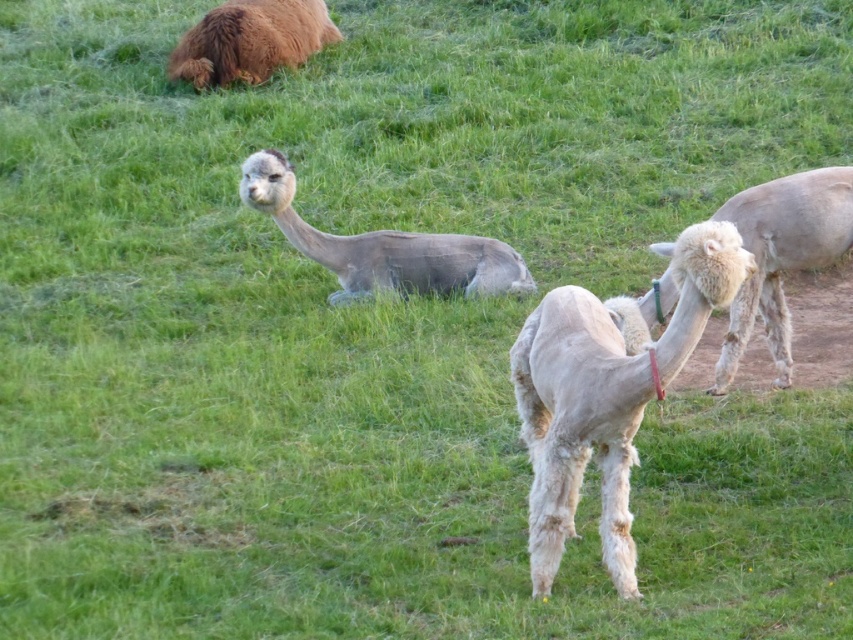
Question: Is white woolen camel at center smaller than fuzzy gray alpaca at center?

Choices:
 (A) yes
 (B) no

Answer: (B)

Question: Estimate the real-world distances between objects in this image. Which object is closer to the white woolen camel at right?

Choices:
 (A) brown fluffy camel at upper left
 (B) white woolen camel at center
 (C) fuzzy gray alpaca at center

Answer: (B)

Question: Estimate the real-world distances between objects in this image. Which object is closer to the fuzzy gray alpaca at center?

Choices:
 (A) white woolen camel at center
 (B) brown fluffy camel at upper left
 (C) white woolen camel at right

Answer: (C)

Question: Which object is closer to the camera taking this photo?

Choices:
 (A) white woolen camel at right
 (B) brown fluffy camel at upper left
 (C) white woolen camel at center

Answer: (C)

Question: In this image, where is white woolen camel at center located relative to brown fluffy camel at upper left?

Choices:
 (A) below
 (B) above

Answer: (A)

Question: Where is white woolen camel at center located in relation to brown fluffy camel at upper left in the image?

Choices:
 (A) right
 (B) left

Answer: (A)